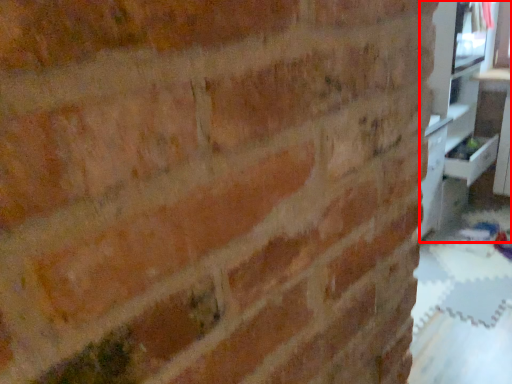
Question: From the image's perspective, what is the correct spatial positioning of entertainment center (annotated by the red box) in reference to drawer?

Choices:
 (A) above
 (B) below

Answer: (A)